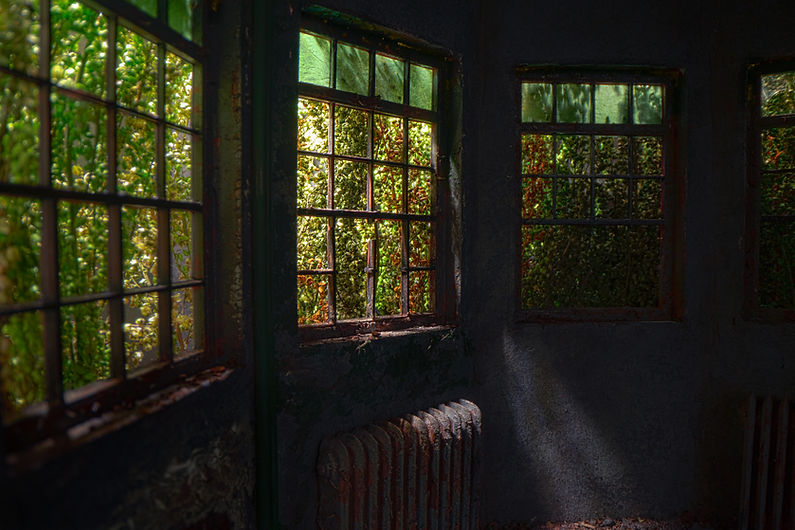
Locate an element on the screen. walls is located at coordinates (637, 417), (362, 394).